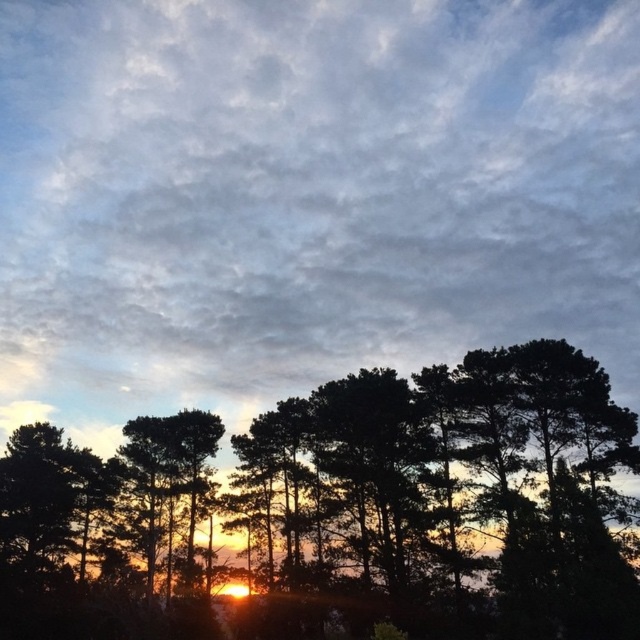
Question: Does cloudy sky at upper center have a lesser width compared to black matte tree at center?

Choices:
 (A) no
 (B) yes

Answer: (A)

Question: Which point is closer to the camera taking this photo?

Choices:
 (A) (307, 449)
 (B) (467, 56)

Answer: (A)

Question: Is cloudy sky at upper center to the left of black matte tree at center from the viewer's perspective?

Choices:
 (A) yes
 (B) no

Answer: (A)

Question: Is cloudy sky at upper center further to camera compared to black matte tree at center?

Choices:
 (A) no
 (B) yes

Answer: (B)

Question: Which object is farther from the camera taking this photo?

Choices:
 (A) cloudy sky at upper center
 (B) black matte tree at center

Answer: (A)